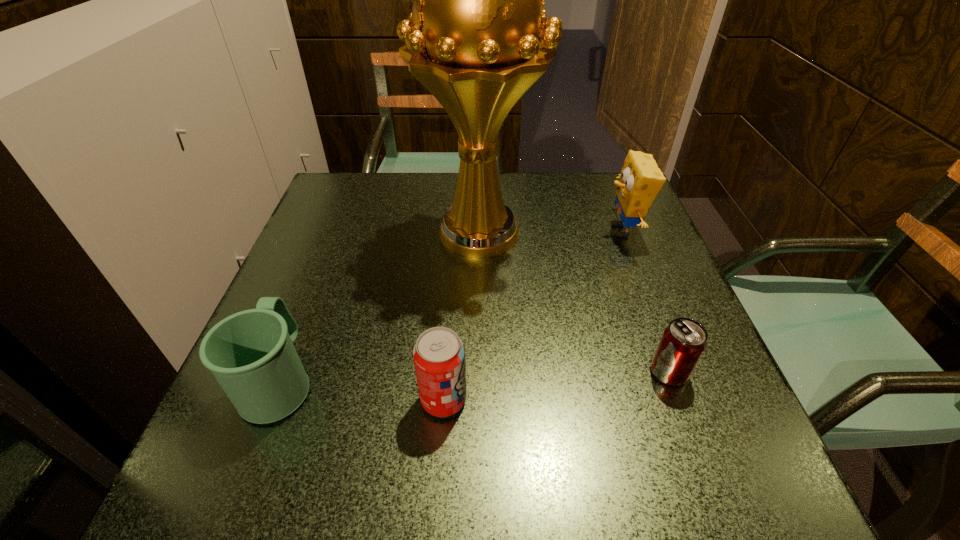
This screenshot has height=540, width=960. Find the location of `trophy_cup`. trophy_cup is located at coordinates (472, 39).

Where is `sponge`? The width and height of the screenshot is (960, 540). sponge is located at coordinates (640, 181).

I want to click on the left pop soda, so click(439, 354).

The image size is (960, 540). Find the location of `the leftmost object`. the leftmost object is located at coordinates (251, 354).

Locate an element on the screen. the right pop soda is located at coordinates (683, 342).

At what (x,y) coordinates should I click in order to perform the action: click on the shorter pop soda. Please return your answer as a coordinate pair (x, y). The width and height of the screenshot is (960, 540). Looking at the image, I should click on (683, 342).

This screenshot has width=960, height=540. Identify the location of vacant space situated at the front of the tallest object where the globe is prominent. (479, 351).

The width and height of the screenshot is (960, 540). In order to click on free space located 0.400m on the face of the fourth shortest object in this screenshot , I will do `click(436, 231)`.

This screenshot has height=540, width=960. Identify the location of vacant position located 0.390m on the face of the fourth shortest object. (441, 231).

Where is `free space located 0.210m on the face of the fourth shortest object`? free space located 0.210m on the face of the fourth shortest object is located at coordinates coord(516,231).